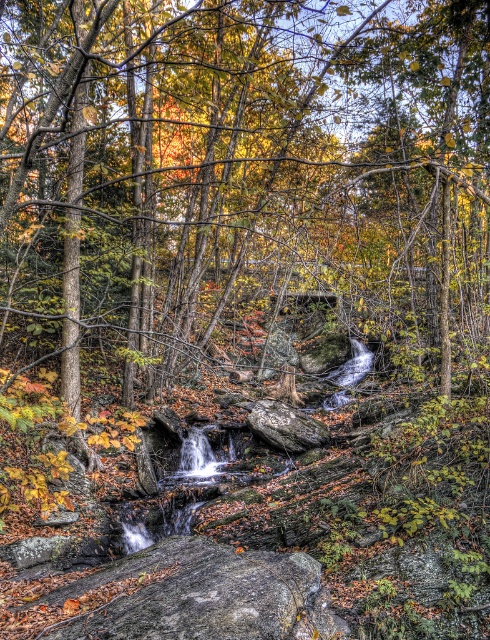
Looking at this image, you are standing at the origin point in the image. Which direction should you move to reach the gray rough boulder at lower center?

The gray rough boulder at lower center is located at point 0.933 on the x axis and 0.414 on the y axis. Since you are at the origin point, you should move right along the x axis and slightly up along the y axis to reach it.

You are standing at the point labeled as point (202, 596) in the autumnal forest scene. What type of object is located at this specific coordinate?

The point (202, 596) corresponds to a gray rough boulder at lower center.

You are a hiker who wants to cross the rocky terrain to reach the waterfall. You see a gray rough boulder at lower center and a rough gray rock at center. Which rock should you step on first to get closer to the waterfall?

You should step on the gray rough boulder at lower center first because it is positioned on the left side of the rough gray rock at center, allowing you to approach the waterfall in the correct direction.